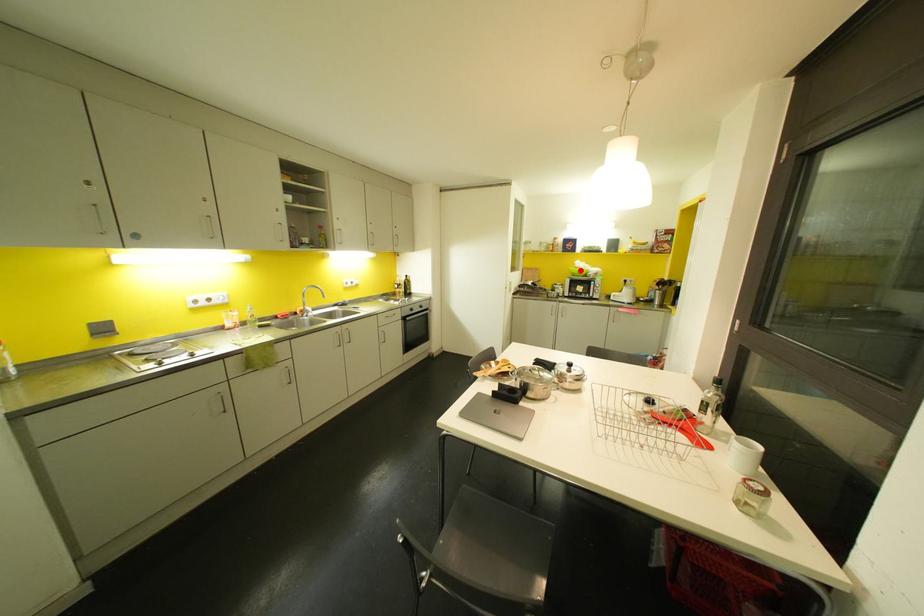
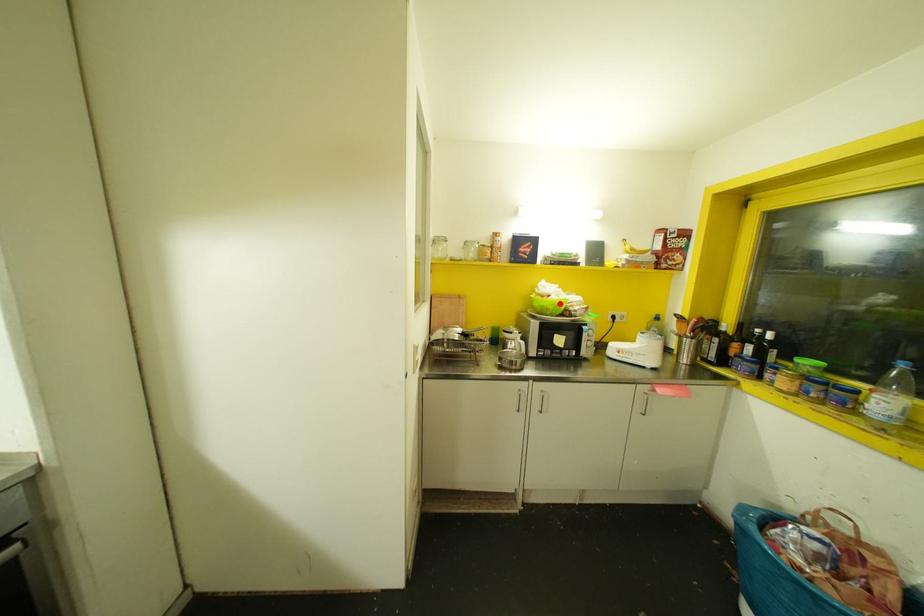
I am providing you with two images of the same scene from different viewpoints. A red point is marked on the first image and another point is marked on the second image. Do the highlighted points in image1 and image2 indicate the same real-world spot?

Yes